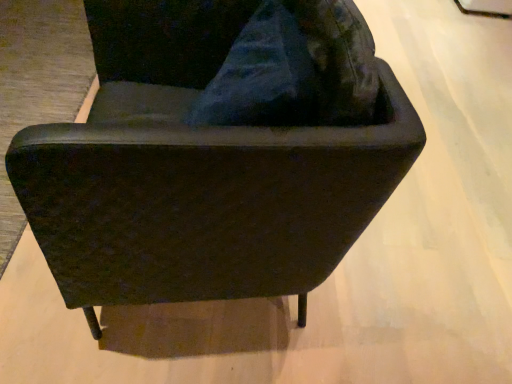
This screenshot has height=384, width=512. In order to click on matte black chair at center in this screenshot , I will do (196, 173).

Image resolution: width=512 pixels, height=384 pixels. What do you see at coordinates (196, 173) in the screenshot?
I see `matte black chair at center` at bounding box center [196, 173].

This screenshot has width=512, height=384. Identify the location of matte black chair at center. (196, 173).